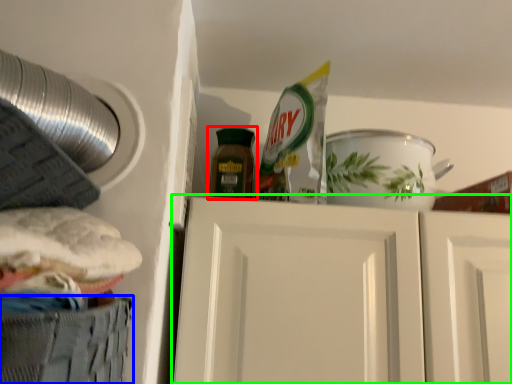
Question: Considering the real-world distances, which object is farthest from bottle (highlighted by a red box)? cabinetry (highlighted by a blue box) or door (highlighted by a green box)?

Choices:
 (A) cabinetry
 (B) door

Answer: (A)